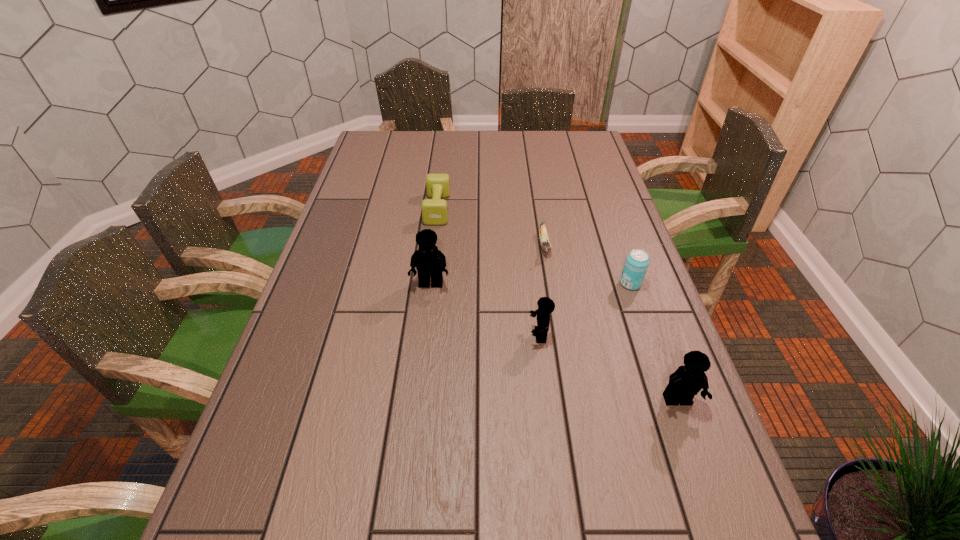
The height and width of the screenshot is (540, 960). What are the coordinates of `vacant region located 0.060m on the front-facing side of the shortest Lego` in the screenshot? It's located at (504, 335).

Image resolution: width=960 pixels, height=540 pixels. I want to click on vacant space situated on the front-facing side of the shortest Lego, so click(x=393, y=335).

The height and width of the screenshot is (540, 960). I want to click on free location located 0.180m on the front-facing side of the shortest Lego, so click(455, 335).

Find the location of `vacant space situated on the front-facing side of the second tallest object`. vacant space situated on the front-facing side of the second tallest object is located at coordinates (705, 477).

Identify the location of vacant space located 0.250m on the back of the dumbbell. This screenshot has width=960, height=540. (444, 157).

The height and width of the screenshot is (540, 960). Find the location of `vacant area situated 0.260m on the front of the third shortest object`. vacant area situated 0.260m on the front of the third shortest object is located at coordinates (661, 374).

Where is `free point located 0.300m on the peel of the banana`? Image resolution: width=960 pixels, height=540 pixels. free point located 0.300m on the peel of the banana is located at coordinates (561, 344).

Find the location of a particular element. This screenshot has width=960, height=540. Lego that is at the right edge is located at coordinates (687, 381).

Find the location of a particular element. The image size is (960, 540). beer can present at the right edge is located at coordinates (636, 264).

In the image, there is a desktop. Identify the location of vacant space at the far edge. The image size is (960, 540). (531, 154).